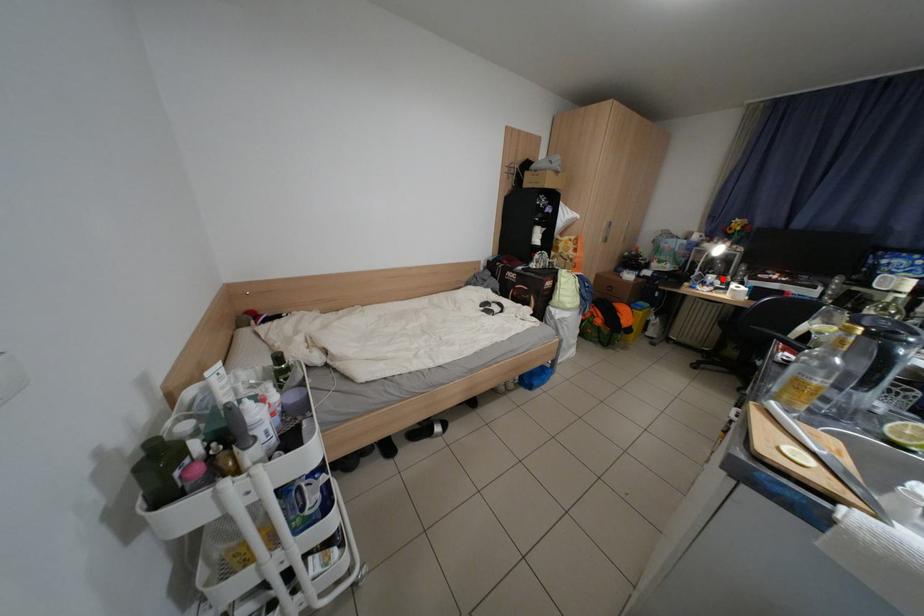
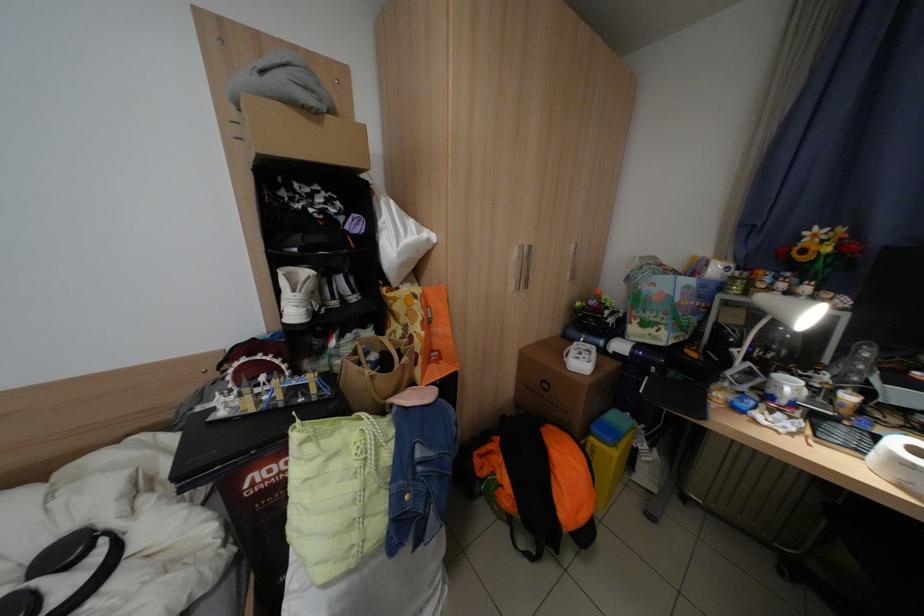
Find the pixel in the second image that matches the highlighted location in the first image.

(800, 387)